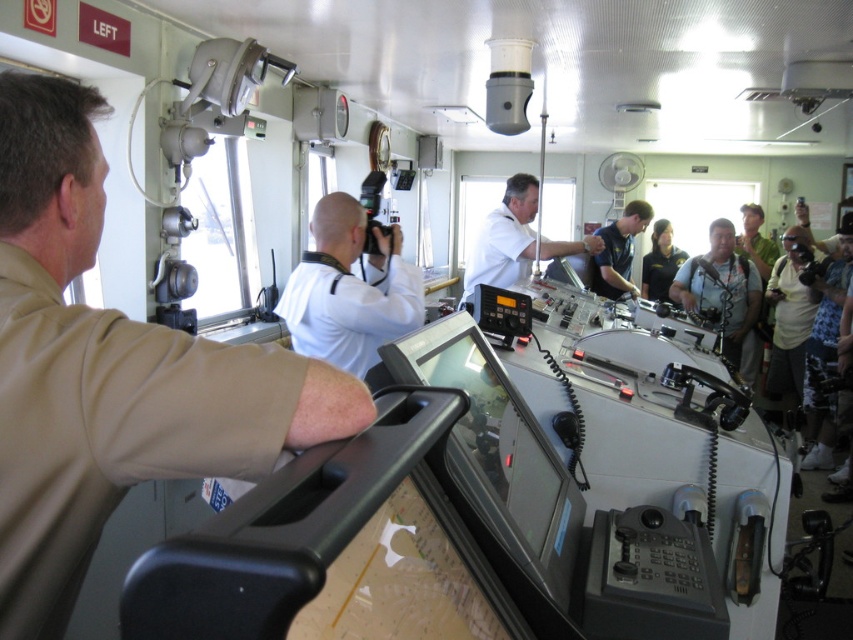
You are a crew member on the ship and need to quickly identify the location of the white matte uniform at center and the blue fabric shirt at center. Based on the scene description, which one is positioned lower in the image?

The white matte uniform at center is located below the blue fabric shirt at center, so it is positioned lower in the image.

You are standing in the ship bridge and see the white matte uniform at center and the dark blue uniform at center. Which one is positioned to the left?

The white matte uniform at center is positioned to the left of the dark blue uniform at center.